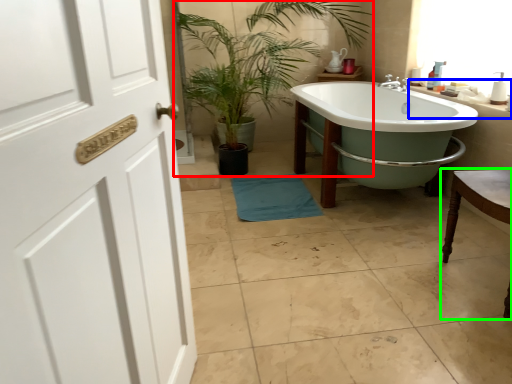
Question: Which object is the closest to the houseplant (highlighted by a red box)? Choose among these: counter top (highlighted by a blue box) or chair (highlighted by a green box).

Choices:
 (A) counter top
 (B) chair

Answer: (A)